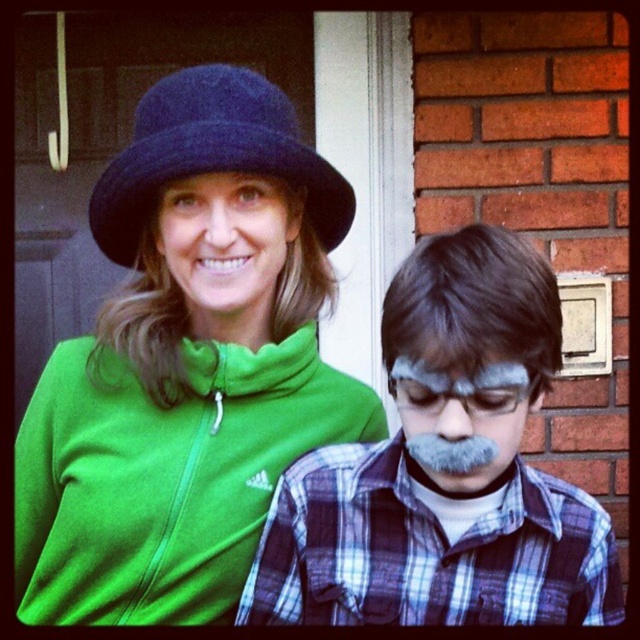
Is matte green hoodie at upper left smaller than plaid fabric shirt at center?

Actually, matte green hoodie at upper left might be larger than plaid fabric shirt at center.

Is point (218, 129) positioned before point (493, 572)?

Yes, it is.

This screenshot has width=640, height=640. I want to click on matte green hoodie at upper left, so click(186, 364).

Based on the photo, who is lower down, dark blue felt hat at upper center or matte green hat at upper center?

matte green hat at upper center

Looking at this image, who is more forward, (308, 202) or (264, 180)?

Point (264, 180) is more forward.

This screenshot has height=640, width=640. I want to click on dark blue felt hat at upper center, so click(211, 154).

Who is lower down, plaid fabric shirt at center or gray matte face at center?

plaid fabric shirt at center is below.

Where is `plaid fabric shirt at center`? The width and height of the screenshot is (640, 640). plaid fabric shirt at center is located at coordinates (444, 468).

Locate an element on the screen. This screenshot has width=640, height=640. plaid fabric shirt at center is located at coordinates (444, 468).